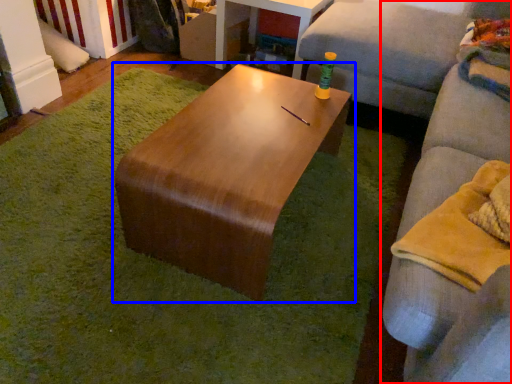
Question: Which object is further to the camera taking this photo, studio couch (highlighted by a red box) or coffee table (highlighted by a blue box)?

Choices:
 (A) studio couch
 (B) coffee table

Answer: (B)